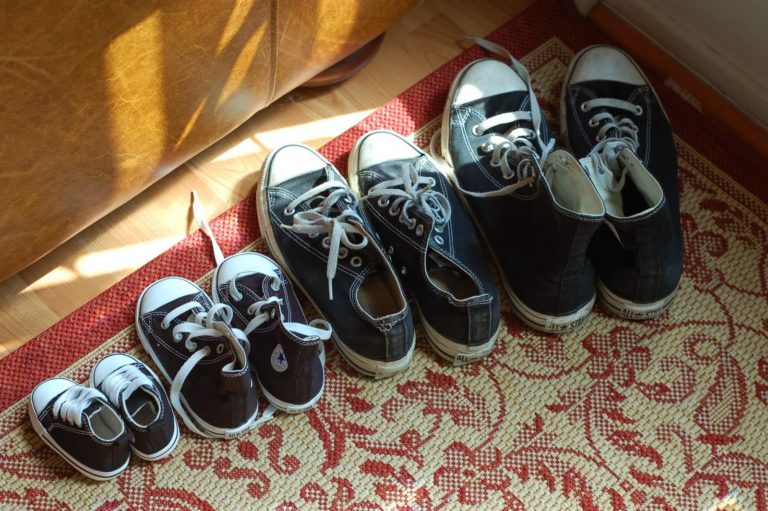
You are a GUI agent. You are given a task and a screenshot of the screen. Output one action in this format:
    pyautogui.click(x=<x>, y=<y>)
    Task: Click on the shoes in the image
    
    Given the screenshot: What is the action you would take?
    pyautogui.click(x=96, y=435), pyautogui.click(x=140, y=411), pyautogui.click(x=223, y=381), pyautogui.click(x=295, y=364), pyautogui.click(x=369, y=303), pyautogui.click(x=449, y=269), pyautogui.click(x=541, y=231), pyautogui.click(x=636, y=249)